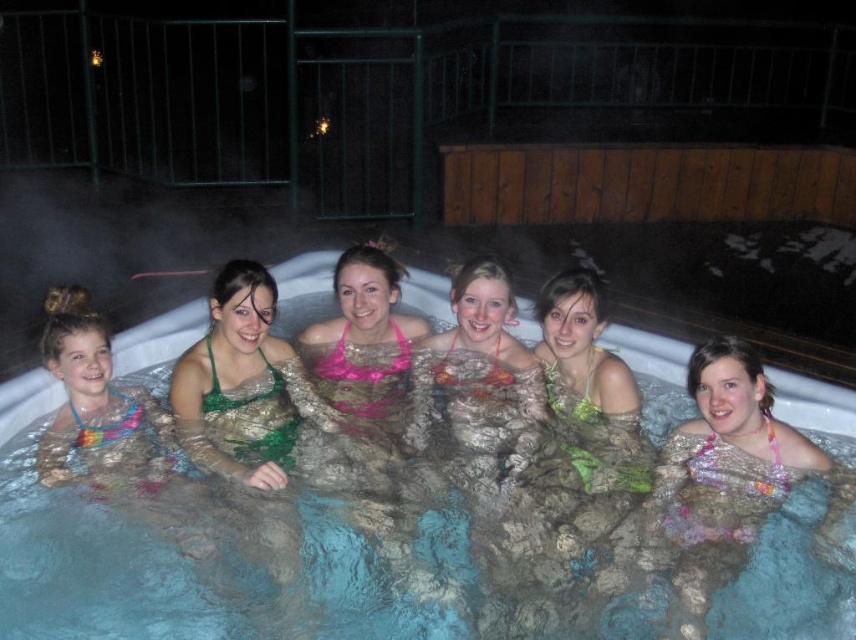
Question: Considering the real-world distances, which object is farthest from the clear plastic pool at center?

Choices:
 (A) pink fabric bikini at center
 (B) pink floral bikini at center
 (C) multicolored fabric bikini at center

Answer: (B)

Question: Among these points, which one is nearest to the camera?

Choices:
 (A) (645, 484)
 (B) (693, 540)
 (C) (16, 612)
 (D) (284, 417)

Answer: (C)

Question: Based on their relative distances, which object is farther from the pink floral bikini at center?

Choices:
 (A) clear plastic pool at center
 (B) pink fabric bikini at center
 (C) multicolored fabric bikini at center
 (D) green fabric swimsuit at center

Answer: (A)

Question: Is clear plastic pool at center wider than pink floral bikini at center?

Choices:
 (A) yes
 (B) no

Answer: (A)

Question: Is clear plastic pool at center behind green fabric swimsuit at center?

Choices:
 (A) no
 (B) yes

Answer: (A)

Question: Observing the image, what is the correct spatial positioning of clear plastic pool at center in reference to pink fabric bikini at center?

Choices:
 (A) above
 (B) below

Answer: (B)